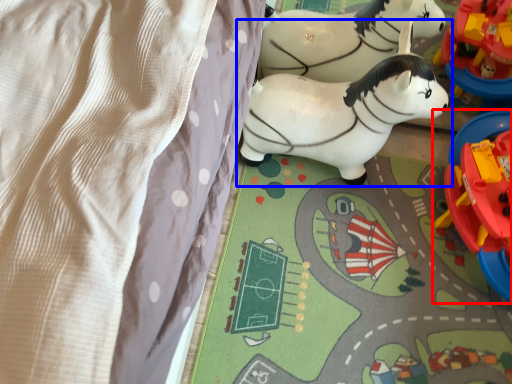
Question: Which object is further to the camera taking this photo, toy (highlighted by a red box) or toy (highlighted by a blue box)?

Choices:
 (A) toy
 (B) toy

Answer: (B)